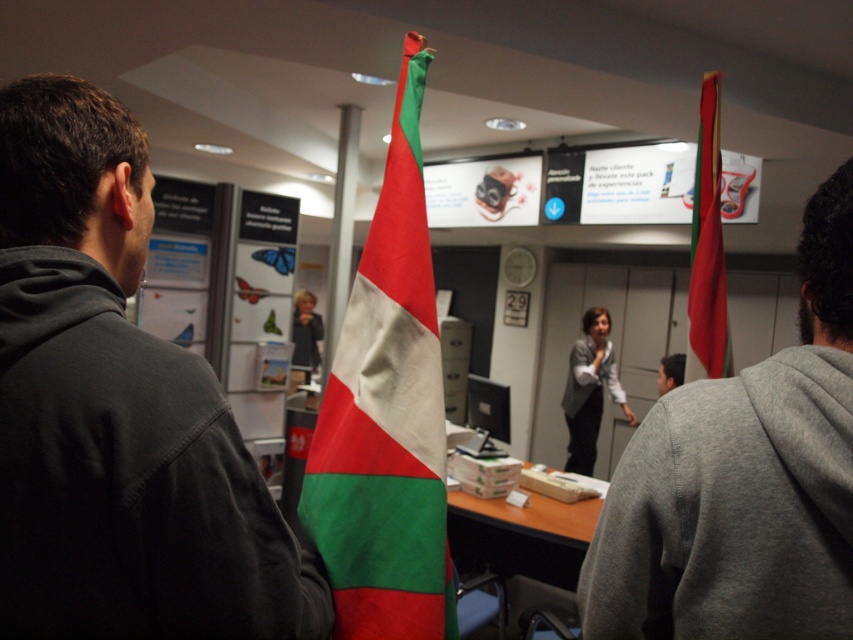
You are standing in the conference room and need to determine the relative positions of two points marked in the image. Which point is closer to you, point [698,220] or point [339,296]?

Point [698,220] is closer to the viewer than point [339,296].